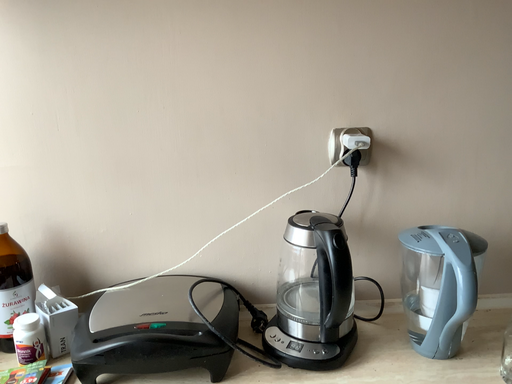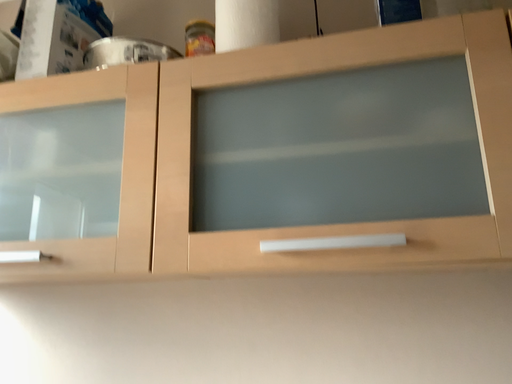
Question: How did the camera likely rotate when shooting the video?

Choices:
 (A) rotated right
 (B) rotated left

Answer: (B)